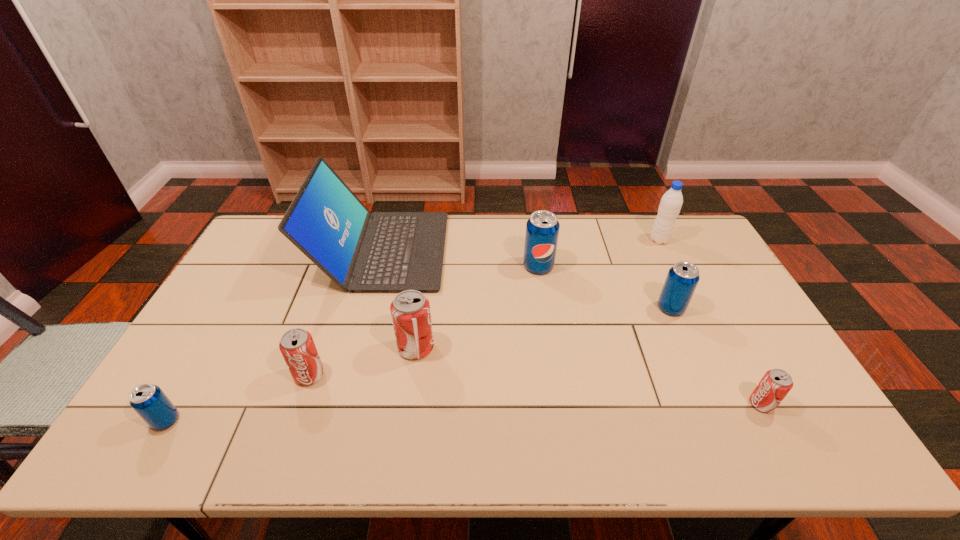
In order to click on laptop computer in this screenshot , I will do `click(360, 251)`.

I want to click on water bottle, so click(671, 202).

You are a GUI agent. You are given a task and a screenshot of the screen. Output one action in this format:
    pyautogui.click(x=<x>, y=<y>)
    Task: Click on the biggest blue pop soda
    
    Given the screenshot: What is the action you would take?
    pyautogui.click(x=542, y=229)

Identify the location of the second blue pop soda from right to left. pos(542,229).

Locate an element on the screen. The width and height of the screenshot is (960, 540). the third farthest soda can is located at coordinates (410, 310).

Find the location of a particular element. This screenshot has width=960, height=540. the farthest pink soda can is located at coordinates (410, 310).

Locate an element on the screen. Image resolution: width=960 pixels, height=540 pixels. the rightmost blue pop soda is located at coordinates (682, 279).

Locate an element on the screen. the second smallest blue pop soda is located at coordinates (682, 279).

What are the coordinates of `the second smallest pink soda can` in the screenshot? It's located at pyautogui.click(x=297, y=346).

Where is `the sixth farthest object`? the sixth farthest object is located at coordinates (297, 346).